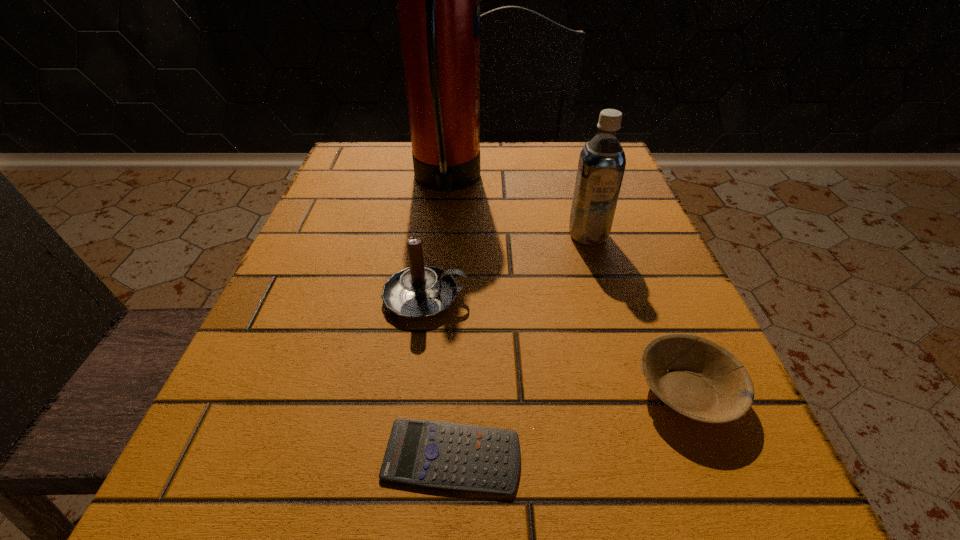
Where is `vacant area between the tallest object and the calculator`? This screenshot has width=960, height=540. vacant area between the tallest object and the calculator is located at coordinates (449, 319).

At what (x,y) coordinates should I click in order to perform the action: click on vacant area that lies between the tallest object and the shortest object. Please return your answer as a coordinate pair (x, y). Image resolution: width=960 pixels, height=540 pixels. Looking at the image, I should click on (449, 319).

You are a GUI agent. You are given a task and a screenshot of the screen. Output one action in this format:
    pyautogui.click(x=<x>, y=<y>)
    Task: Click on the third closest object relative to the bowl
    
    Given the screenshot: What is the action you would take?
    pyautogui.click(x=602, y=161)

Choose which object is the second nearest neighbor to the second farthest object. Please provide its 2D coordinates. Your answer should be formatted as a tuple, i.e. [(x, y)], where the tuple contains the x and y coordinates of a point satisfying the conditions above.

[(417, 292)]

At what (x,y) coordinates should I click in order to perform the action: click on blank area in the image that satisfies the following two spatial constraints: 1. on the surface of the bowl; 2. on the left side of the tallest object. Please return your answer as a coordinate pair (x, y). The height and width of the screenshot is (540, 960). Looking at the image, I should click on (423, 392).

Find the location of a particular element. The height and width of the screenshot is (540, 960). vacant space that satisfies the following two spatial constraints: 1. on the surface of the tallest object; 2. on the left side of the bowl is located at coordinates (423, 392).

Identify the location of vacant space that satisfies the following two spatial constraints: 1. on the side of the candle with the handle loop; 2. on the right side of the fourth tallest object. This screenshot has height=540, width=960. tap(414, 392).

Locate an element on the screen. free space that satisfies the following two spatial constraints: 1. on the label of the second farthest object; 2. on the side of the third tallest object with the handle loop is located at coordinates (607, 298).

You are a GUI agent. You are given a task and a screenshot of the screen. Output one action in this format:
    pyautogui.click(x=<x>, y=<y>)
    Task: Click on the vacant area that satisfies the following two spatial constraints: 1. on the label of the bowl; 2. on the right side of the soya milk
    
    Given the screenshot: What is the action you would take?
    (636, 392)

Locate an element on the screen. The image size is (960, 540). vacant space that satisfies the following two spatial constraints: 1. on the surface of the shortest object; 2. on the right side of the farthest object is located at coordinates (416, 457).